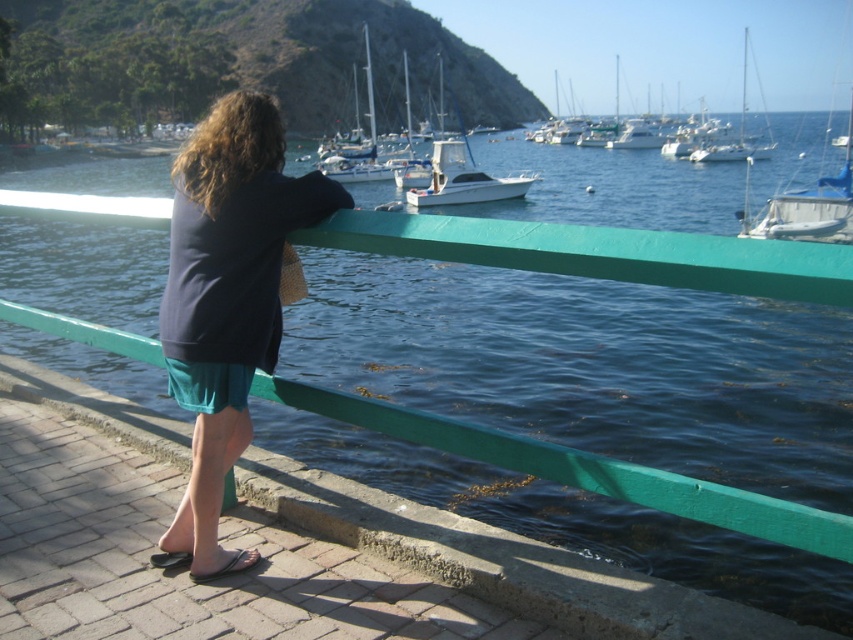
Who is taller, white glossy boat at center or brown leather sandal at lower left?

white glossy boat at center is taller.

Image resolution: width=853 pixels, height=640 pixels. I want to click on white glossy boat at center, so click(x=459, y=176).

Which is below, dark blue sweater at center or white glossy boat at center?

Positioned lower is dark blue sweater at center.

Based on the photo, does dark blue sweater at center have a smaller size compared to white glossy boat at center?

Indeed, dark blue sweater at center has a smaller size compared to white glossy boat at center.

Image resolution: width=853 pixels, height=640 pixels. I want to click on dark blue sweater at center, so click(227, 294).

Which is more to the right, dark blue sweater at center or white glossy sailboat at upper right?

white glossy sailboat at upper right

Does point (189, 141) lie behind point (730, 160)?

Yes, point (189, 141) is behind point (730, 160).

Measure the distance between dark blue sweater at center and camera.

9.18 feet

Identify the location of dark blue sweater at center. (227, 294).